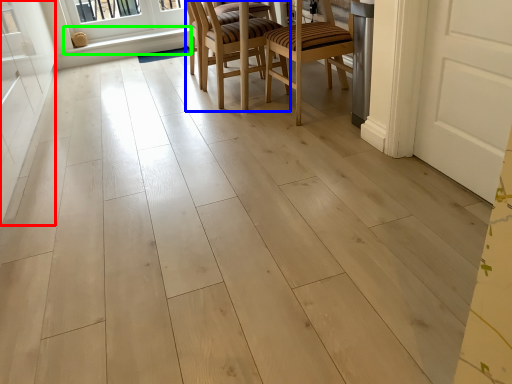
Question: Which object is positioned farthest from screen door (highlighted by a red box)? Select from chair (highlighted by a blue box) and window sill (highlighted by a green box).

Choices:
 (A) chair
 (B) window sill

Answer: (B)